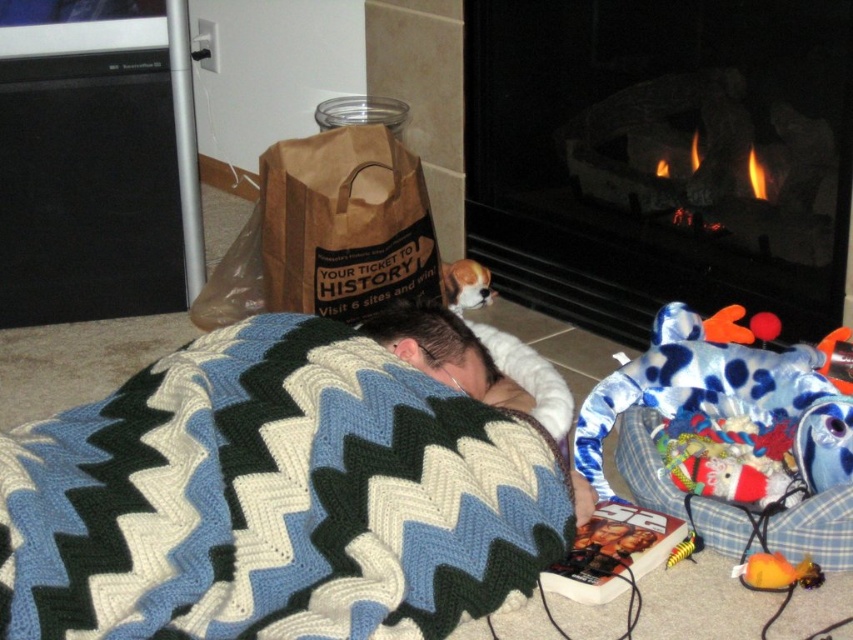
What do you see at coordinates (273, 499) in the screenshot? Image resolution: width=853 pixels, height=640 pixels. I see `woolen zigzag blanket at center` at bounding box center [273, 499].

Locate an element on the screen. This screenshot has height=640, width=853. woolen zigzag blanket at center is located at coordinates (273, 499).

Is woolen zigzag blanket at center to the right of smooth stone fireplace at center from the viewer's perspective?

No, woolen zigzag blanket at center is not to the right of smooth stone fireplace at center.

Is woolen zigzag blanket at center bigger than smooth stone fireplace at center?

No.

Describe the element at coordinates (273, 499) in the screenshot. This screenshot has width=853, height=640. I see `woolen zigzag blanket at center` at that location.

Locate an element on the screen. This screenshot has width=853, height=640. woolen zigzag blanket at center is located at coordinates (273, 499).

Which of these two, smooth stone fireplace at center or brown fur dog at upper center, stands shorter?

brown fur dog at upper center is shorter.

Which is above, smooth stone fireplace at center or brown fur dog at upper center?

Positioned higher is smooth stone fireplace at center.

Is point (466, 56) less distant than point (453, 291)?

Yes, point (466, 56) is in front of point (453, 291).

The height and width of the screenshot is (640, 853). Find the location of `smooth stone fireplace at center`. smooth stone fireplace at center is located at coordinates 659,156.